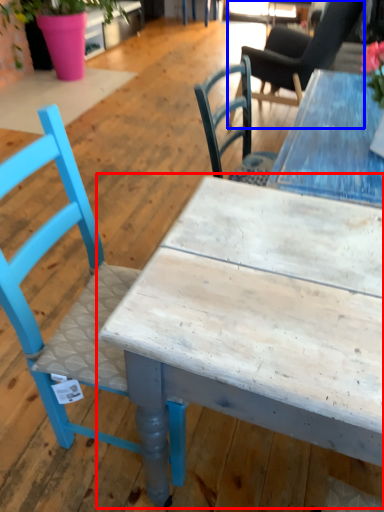
Question: Which of the following is the farthest to the observer, table (highlighted by a red box) or chair (highlighted by a blue box)?

Choices:
 (A) table
 (B) chair

Answer: (B)